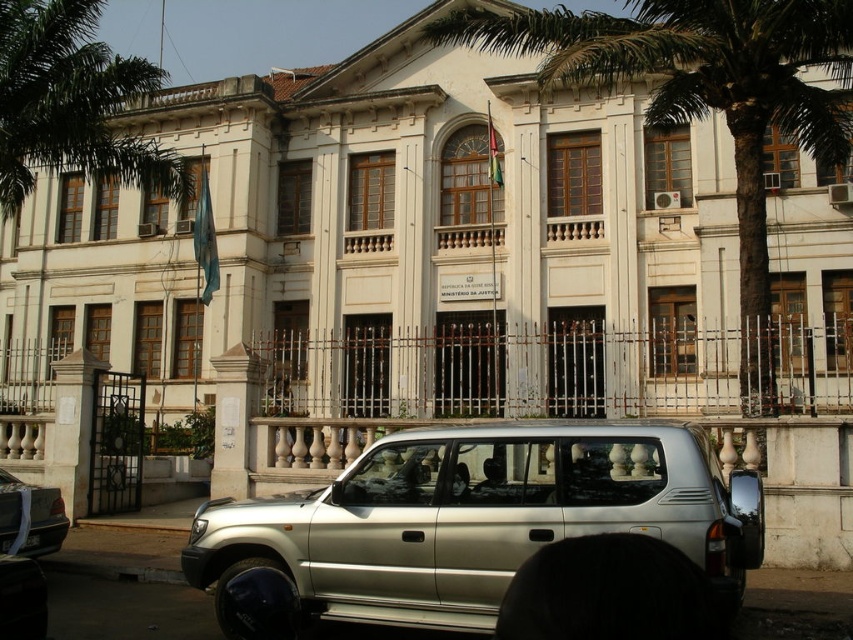
Question: Which point appears farthest from the camera in this image?

Choices:
 (A) (28, 536)
 (B) (53, 490)
 (C) (817, 1)

Answer: (C)

Question: Which object is farther from the camera taking this photo?

Choices:
 (A) silver metallic suv at lower left
 (B) black plastic license plate at center
 (C) silver metallic suv at center
 (D) green leafy palm tree at center

Answer: (D)

Question: Among these objects, which one is nearest to the camera?

Choices:
 (A) black plastic license plate at center
 (B) green leafy palm tree at upper left
 (C) green leafy palm tree at center
 (D) silver metallic suv at center

Answer: (D)

Question: Is green leafy palm tree at upper left to the right of black plastic license plate at center from the viewer's perspective?

Choices:
 (A) yes
 (B) no

Answer: (B)

Question: Where is green leafy palm tree at upper left located in relation to silver metallic suv at lower left in the image?

Choices:
 (A) below
 (B) above

Answer: (B)

Question: Is green leafy palm tree at center smaller than silver metallic suv at lower left?

Choices:
 (A) no
 (B) yes

Answer: (A)